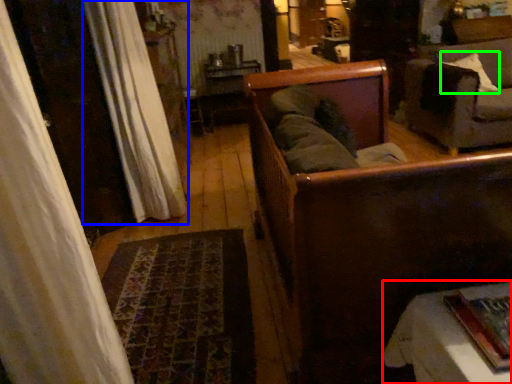
Question: Which object is the closest to the furniture (highlighted by a red box)? Choose among these: curtain (highlighted by a blue box) or pillow (highlighted by a green box).

Choices:
 (A) curtain
 (B) pillow

Answer: (A)